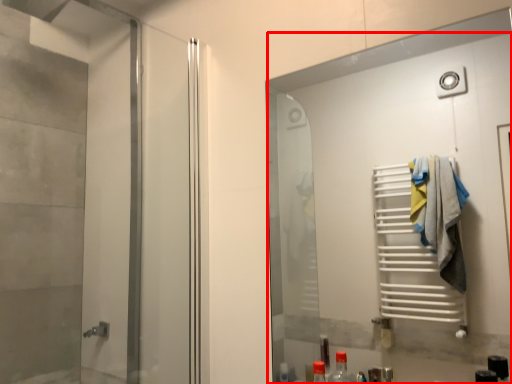
Question: From the image's perspective, what is the correct spatial relationship of door (annotated by the red box) in relation to elevator?

Choices:
 (A) below
 (B) above

Answer: (A)